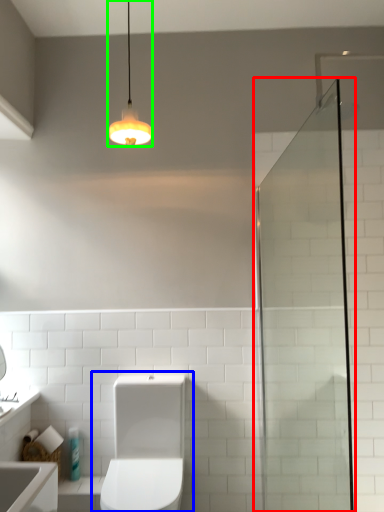
Question: Based on their relative distances, which object is farther from screen door (highlighted by a red box)? Choose from toilet (highlighted by a blue box) and light fixture (highlighted by a green box).

Choices:
 (A) toilet
 (B) light fixture

Answer: (B)